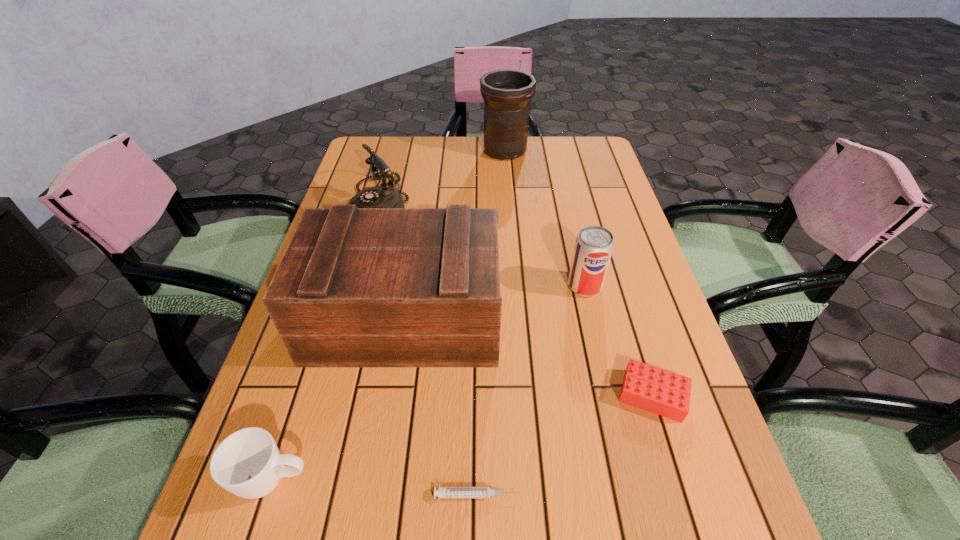
At what (x,y) coordinates should I click in order to perform the action: click on free space located 0.180m on the right of the second farthest object. Please return your answer as a coordinate pair (x, y). Looking at the image, I should click on (473, 200).

Where is `vacant space situated on the left of the soda`? Image resolution: width=960 pixels, height=540 pixels. vacant space situated on the left of the soda is located at coordinates (439, 286).

Locate an element on the screen. This screenshot has height=540, width=960. vacant area situated 0.360m with the handle on the side of the cup is located at coordinates (534, 480).

The height and width of the screenshot is (540, 960). I want to click on vacant space located 0.110m on the front of the Lego, so click(x=681, y=487).

Identify the location of vacant area located at the needle end of the syringe. (561, 495).

The image size is (960, 540). In order to click on telephoto lens positioned at the far edge in this screenshot , I will do `click(507, 94)`.

Locate an element on the screen. This screenshot has height=540, width=960. telephone present at the far edge is located at coordinates (384, 196).

Where is `box at the left edge`? box at the left edge is located at coordinates (356, 287).

Locate an element on the screen. The image size is (960, 540). telephone that is at the left edge is located at coordinates (384, 196).

Where is `cup at the left edge`? This screenshot has height=540, width=960. cup at the left edge is located at coordinates (247, 463).